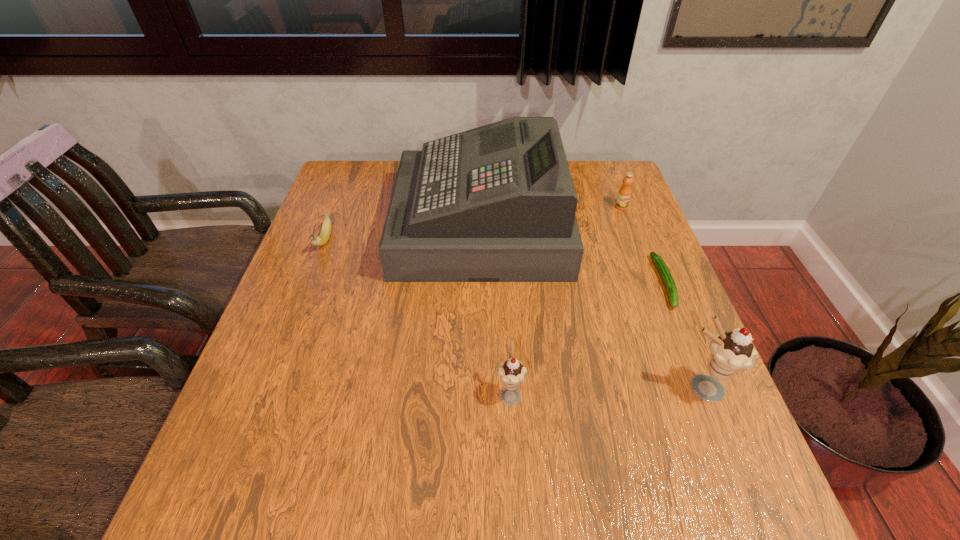
Please point a spot on the left to add another icecream. Please provide its 2D coordinates. Your answer should be formatted as a tuple, i.e. [(x, y)], where the tuple contains the x and y coordinates of a point satisfying the conditions above.

[(316, 397)]